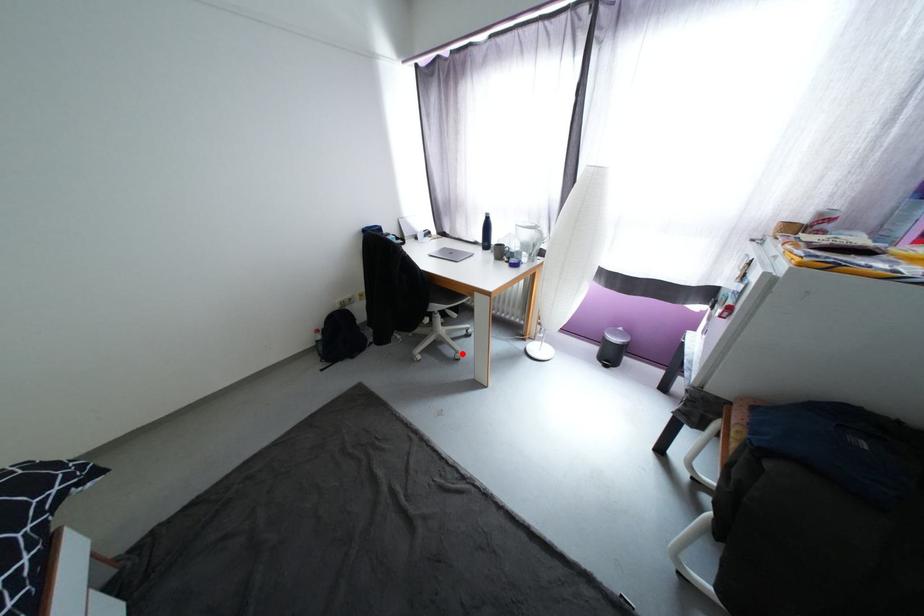
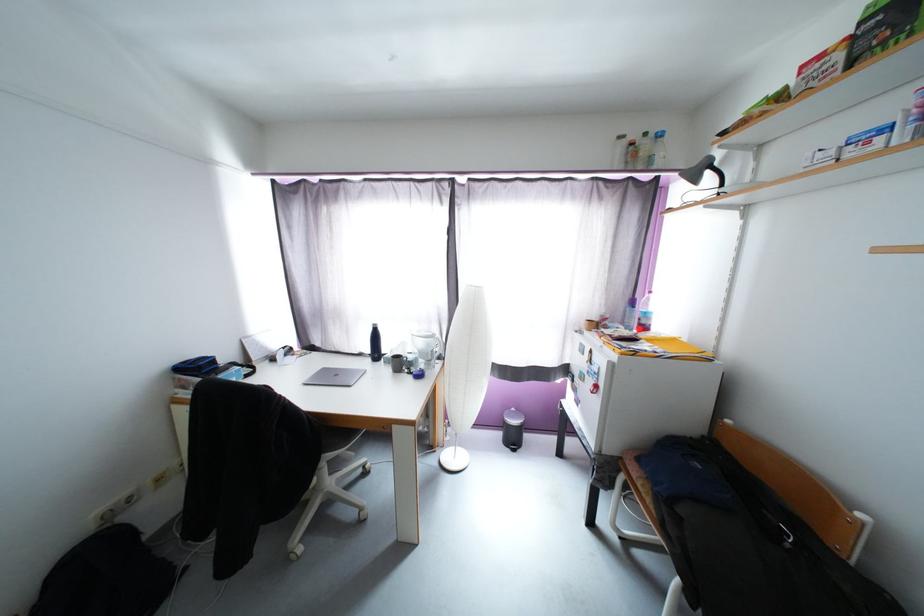
The point at the highlighted location is marked in the first image. Where is the corresponding point in the second image?

(367, 511)